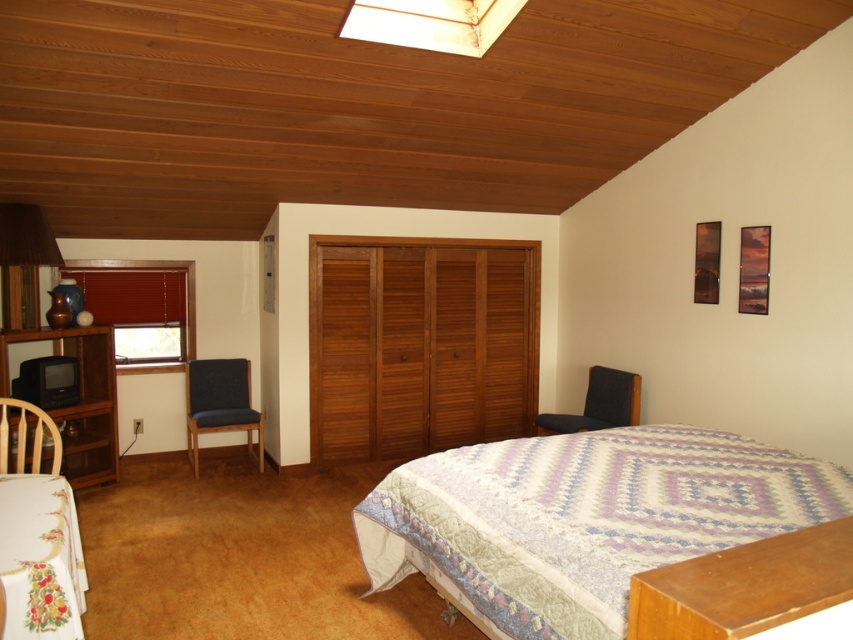
Consider the image. Can you confirm if patterned fabric bed at center is taller than matte wood lampshade at upper center?

Yes.

Is patterned fabric bed at center bigger than matte wood lampshade at upper center?

Yes, patterned fabric bed at center is bigger than matte wood lampshade at upper center.

Is point (564, 500) positioned before point (447, 22)?

Yes, point (564, 500) is in front of point (447, 22).

Image resolution: width=853 pixels, height=640 pixels. I want to click on patterned fabric bed at center, so click(582, 518).

Measure the distance from patterned fabric bed at center to brown fabric lampshade at left.

patterned fabric bed at center and brown fabric lampshade at left are 2.85 meters apart.

Does point (544, 600) come farther from viewer compared to point (19, 241)?

That is False.

Between point (585, 545) and point (3, 250), which one is positioned behind?

The point (3, 250) is more distant.

Identify the location of patterned fabric bed at center. (582, 518).

How much distance is there between wooden closet at center and black wood dresser at left?

wooden closet at center is 5.26 feet away from black wood dresser at left.

Can you confirm if wooden closet at center is thinner than black wood dresser at left?

Incorrect, wooden closet at center's width is not less than black wood dresser at left's.

Which is behind, point (457, 296) or point (9, 336)?

The point (457, 296) is behind.

Locate an element on the screen. wooden closet at center is located at coordinates (421, 346).